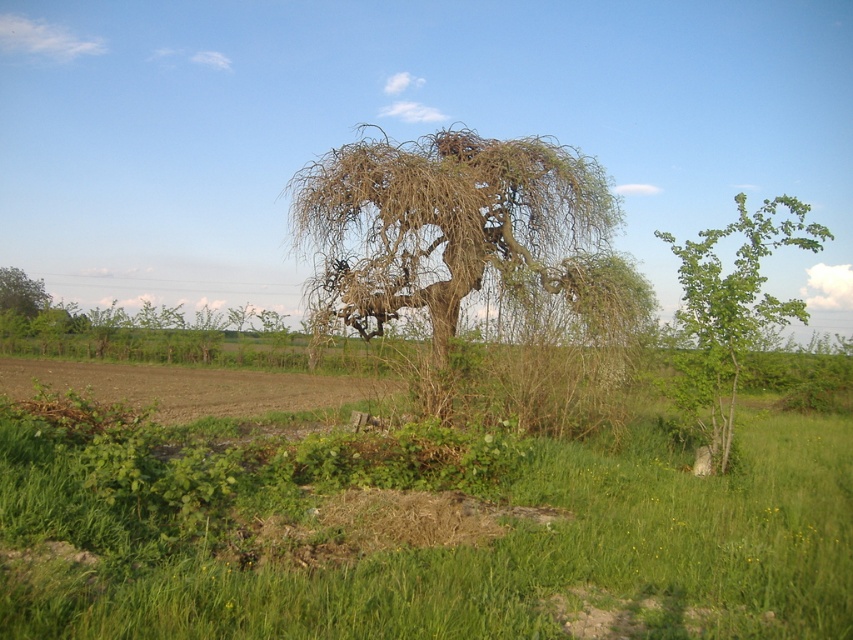
Who is taller, bare branches at center or green leafy tree at right?

With more height is bare branches at center.

Can you confirm if bare branches at center is taller than green leafy tree at right?

Yes, bare branches at center is taller than green leafy tree at right.

Who is more distant from viewer, (x=439, y=172) or (x=700, y=259)?

The point (x=439, y=172) is more distant.

Identify the location of bare branches at center. (456, 237).

Can you confirm if bare branches at center is thinner than green leafy tree at left?

No.

Who is positioned more to the right, bare branches at center or green leafy tree at left?

bare branches at center is more to the right.

Which is behind, point (447, 349) or point (36, 314)?

Point (36, 314)

Where is `bare branches at center`? The image size is (853, 640). bare branches at center is located at coordinates (456, 237).

Who is higher up, green grass at center or green leafy tree at left?

green leafy tree at left is higher up.

What do you see at coordinates (412, 529) in the screenshot?
I see `green grass at center` at bounding box center [412, 529].

Image resolution: width=853 pixels, height=640 pixels. I want to click on green grass at center, so click(412, 529).